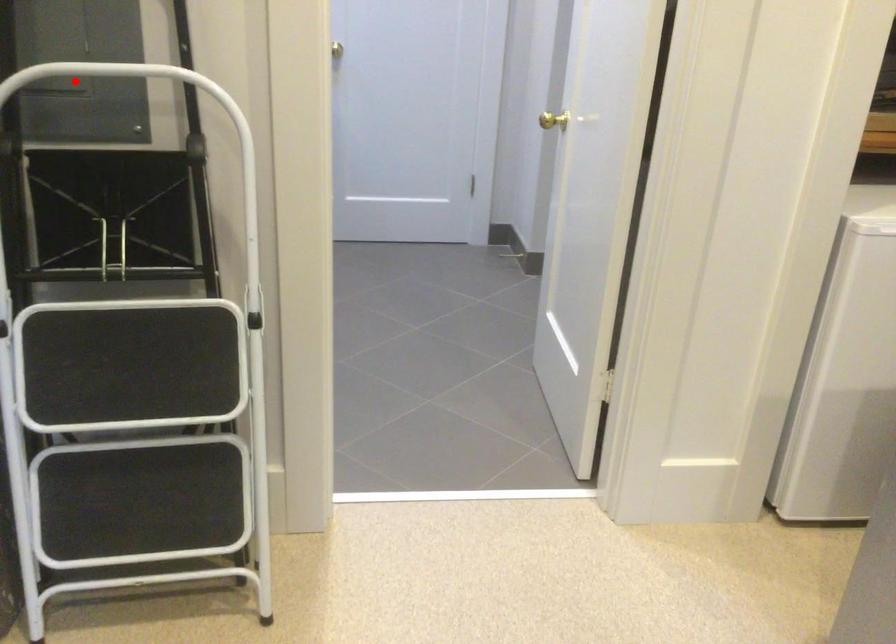
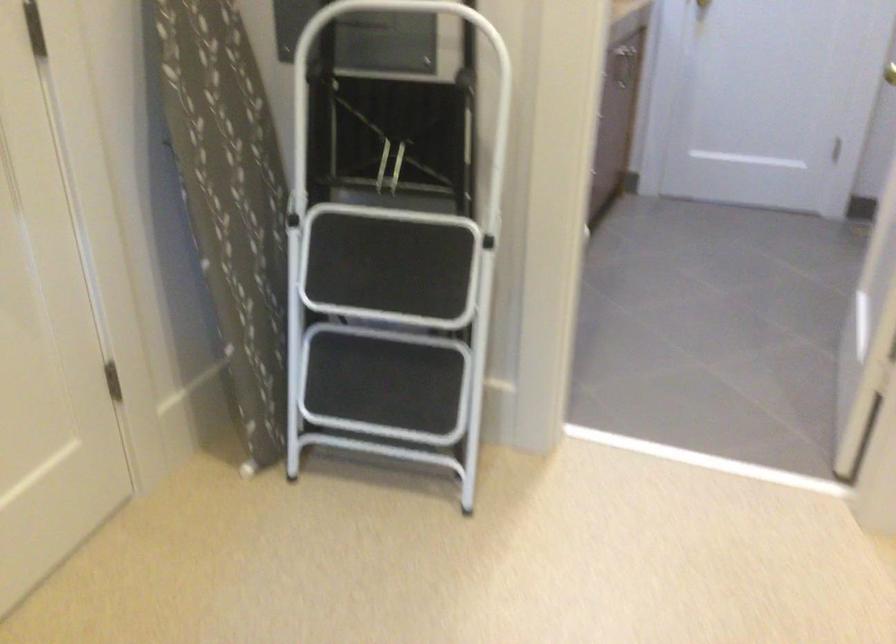
Question: I am providing you with two images of the same scene from different viewpoints. Given a red point in image1, look at the same physical point in image2. Is it:

Choices:
 (A) Closer to the viewpoint
 (B) Farther from the viewpoint

Answer: (B)